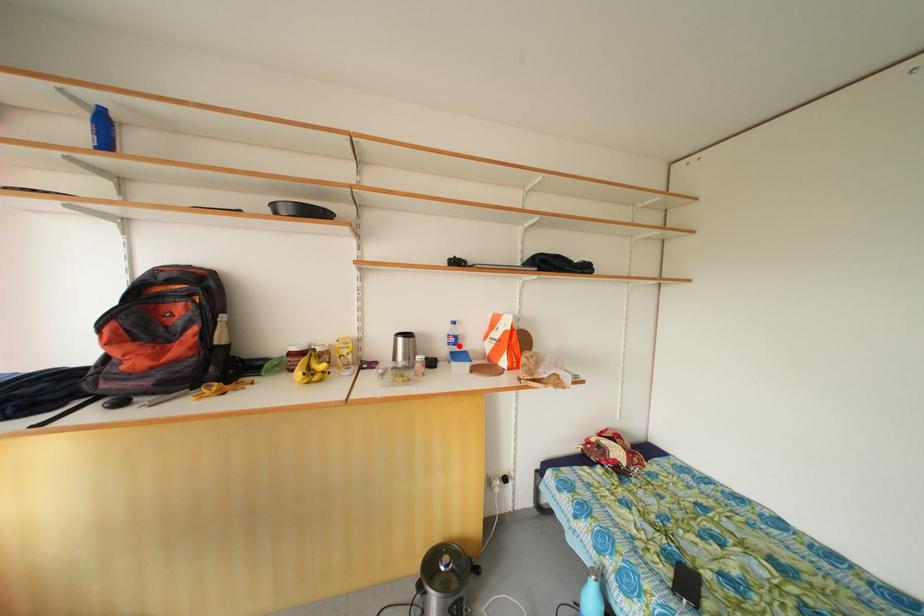
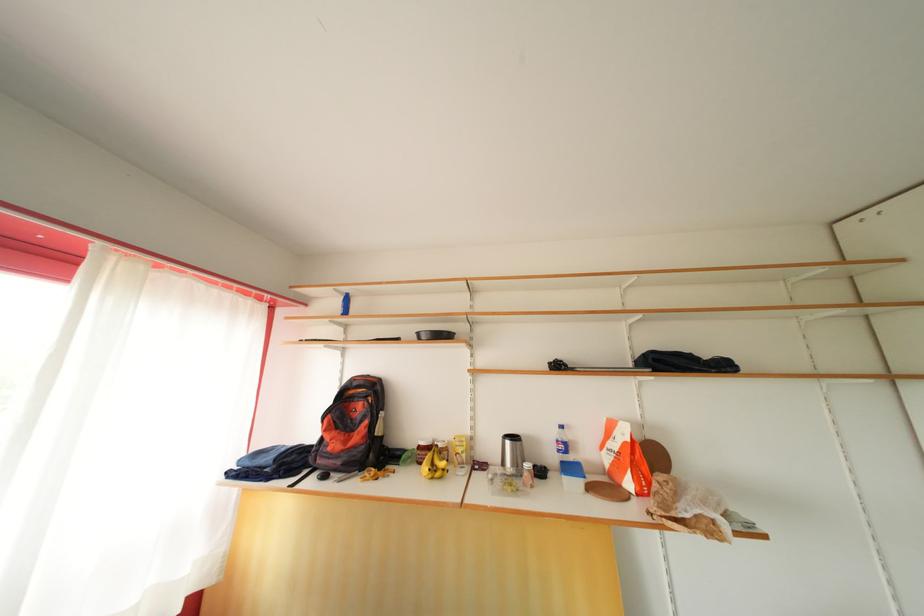
In the second image, find the point that corresponds to the highlighted location in the first image.

(568, 453)